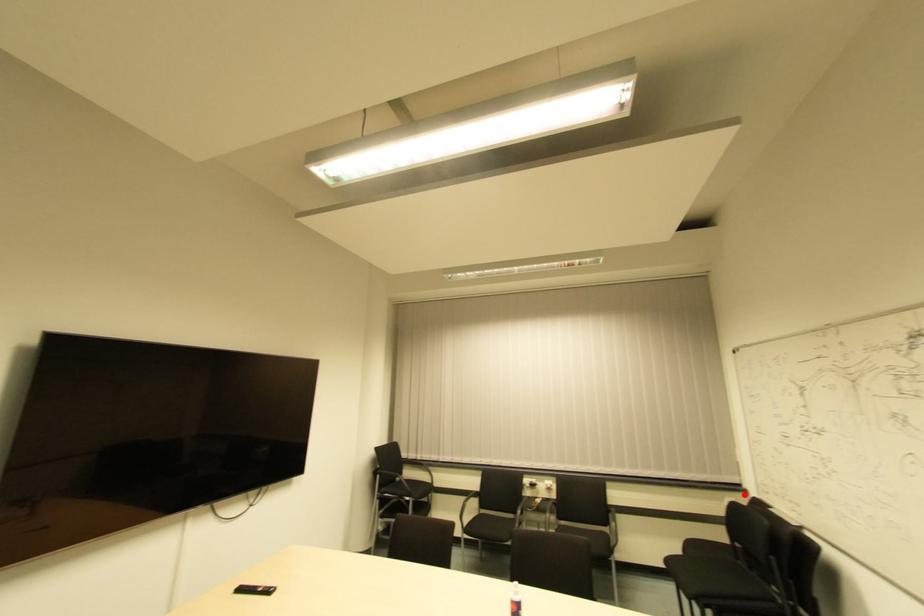
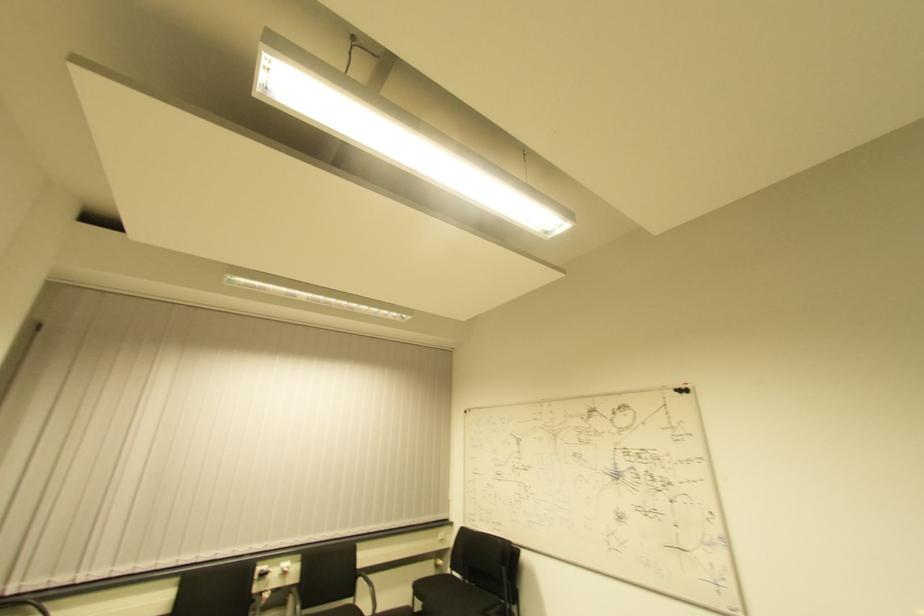
Question: A red point is marked in image1. In image2, is the corresponding 3D point closer to the camera or farther? Reply with the corresponding letter.

Choices:
 (A) The corresponding 3D point is closer.
 (B) The corresponding 3D point is farther.

Answer: (B)